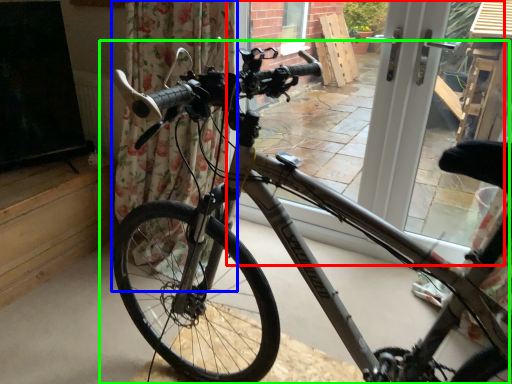
Question: Estimate the real-world distances between objects in this image. Which object is farther from window frame (highlighted by a red box), curtain (highlighted by a blue box) or bicycle (highlighted by a green box)?

Choices:
 (A) curtain
 (B) bicycle

Answer: (A)